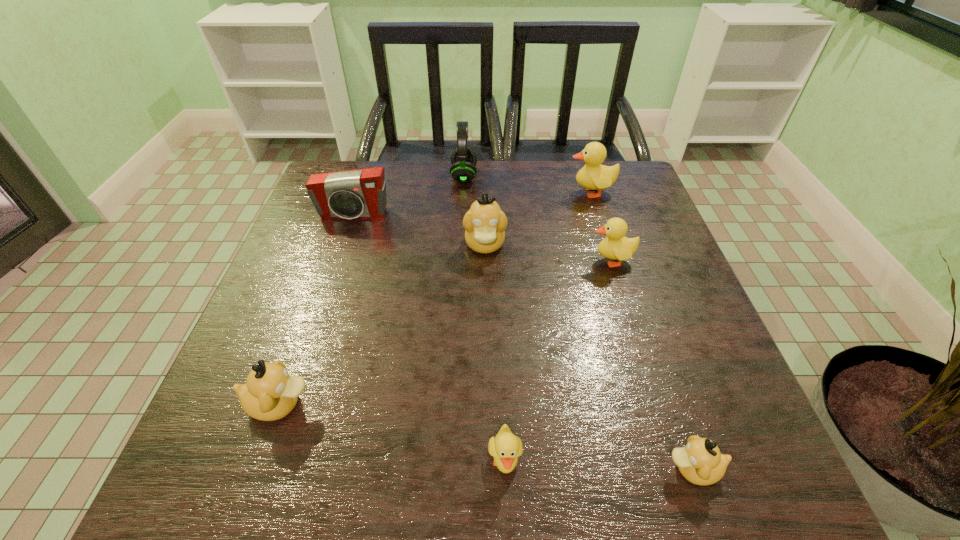
In order to click on vacant space located 0.260m on the front-facing side of the second smallest yellow duckling in this screenshot , I will do coord(478,260).

Where is `vacant space located 0.370m on the front-facing side of the second smallest yellow duckling`? The width and height of the screenshot is (960, 540). vacant space located 0.370m on the front-facing side of the second smallest yellow duckling is located at coordinates (432, 260).

What are the coordinates of `vacant point located 0.370m on the face of the second biggest tan duckling` in the screenshot? It's located at pyautogui.click(x=523, y=404).

In order to click on free space located 0.060m on the face of the smallest tan duckling in this screenshot , I will do `click(627, 469)`.

At what (x,y) coordinates should I click in order to perform the action: click on blank space located 0.080m on the face of the smallest tan duckling. Please return your answer as a coordinate pair (x, y). This screenshot has height=540, width=960. Looking at the image, I should click on (613, 469).

At what (x,y) coordinates should I click in order to perform the action: click on free region located 0.160m on the face of the smallest tan duckling. Please return your answer as a coordinate pair (x, y). This screenshot has width=960, height=540. Looking at the image, I should click on (564, 469).

Identify the location of headset that is at the far edge. This screenshot has height=540, width=960. (463, 159).

This screenshot has width=960, height=540. I want to click on duckling that is at the far edge, so click(593, 176).

Locate an element on the screen. The width and height of the screenshot is (960, 540). camera that is at the far edge is located at coordinates (x=361, y=193).

Find the location of a particular element. The width and height of the screenshot is (960, 540). camera located at the left edge is located at coordinates [x=361, y=193].